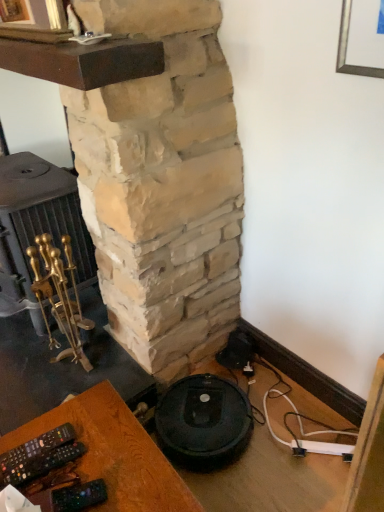
You are a GUI agent. You are given a task and a screenshot of the screen. Output one action in this format:
    pyautogui.click(x=<x>, y=<y>)
    Task: Click on the vacant point above black plastic remote control at lower left (from a real-world perspective)
    
    Given the screenshot: What is the action you would take?
    pyautogui.click(x=91, y=462)